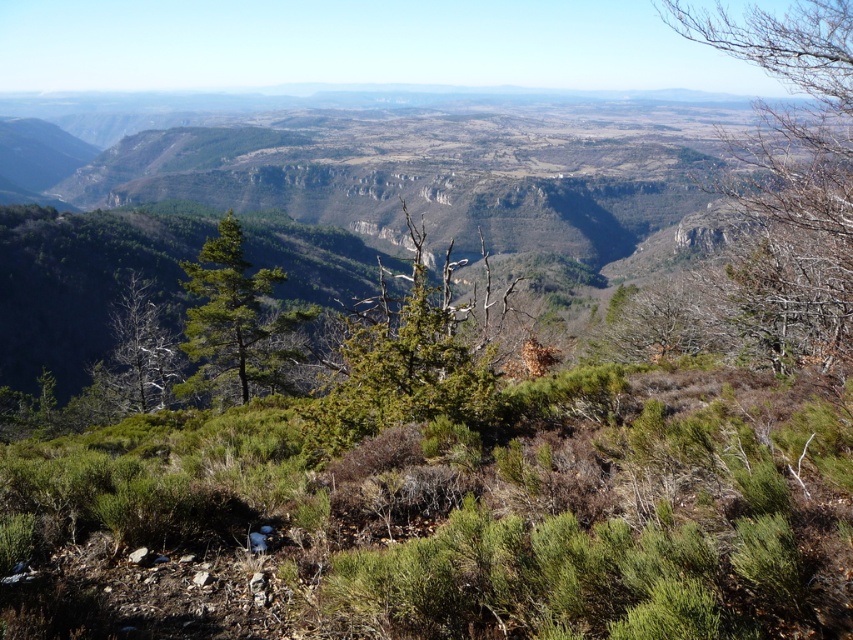
The width and height of the screenshot is (853, 640). In order to click on bare branches at upper right in this screenshot , I will do `click(792, 180)`.

Where is `bare branches at upper right`? This screenshot has width=853, height=640. bare branches at upper right is located at coordinates (792, 180).

Which is above, green matte tree at center or dead wood at left?

dead wood at left

In the scene shown: Is green matte tree at center further to camera compared to dead wood at left?

That is False.

In order to click on green matte tree at center in this screenshot , I will do `click(235, 321)`.

Where is `green matte tree at center`? Image resolution: width=853 pixels, height=640 pixels. green matte tree at center is located at coordinates (235, 321).

Is green leafy tree at center above dead wood at left?

Correct, green leafy tree at center is located above dead wood at left.

Between green leafy tree at center and dead wood at left, which one appears on the right side from the viewer's perspective?

From the viewer's perspective, green leafy tree at center appears more on the right side.

Between point (320, 416) and point (149, 321), which one is positioned behind?

The point (149, 321) is more distant.

This screenshot has height=640, width=853. I want to click on green leafy tree at center, so click(x=403, y=364).